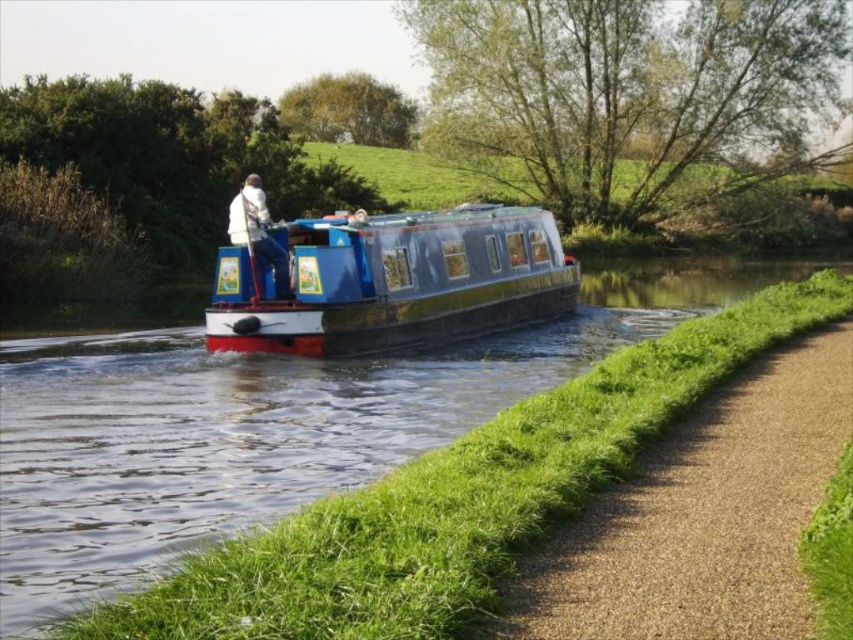
Question: Which object is closer to the camera taking this photo?

Choices:
 (A) gravel path at lower right
 (B) white matte jacket at center

Answer: (A)

Question: Considering the relative positions of gravel path at lower right and blue polished wood boat at center in the image provided, where is gravel path at lower right located with respect to blue polished wood boat at center?

Choices:
 (A) left
 (B) right

Answer: (B)

Question: Is blue glossy canal boat at center closer to the viewer compared to white matte jacket at center?

Choices:
 (A) no
 (B) yes

Answer: (B)

Question: Can you confirm if blue glossy canal boat at center is positioned above blue polished wood boat at center?

Choices:
 (A) no
 (B) yes

Answer: (A)

Question: Estimate the real-world distances between objects in this image. Which object is closer to the gravel path at lower right?

Choices:
 (A) white matte jacket at center
 (B) blue polished wood boat at center

Answer: (B)

Question: Which point is farther to the camera?

Choices:
 (A) (392, 342)
 (B) (608, 556)

Answer: (A)